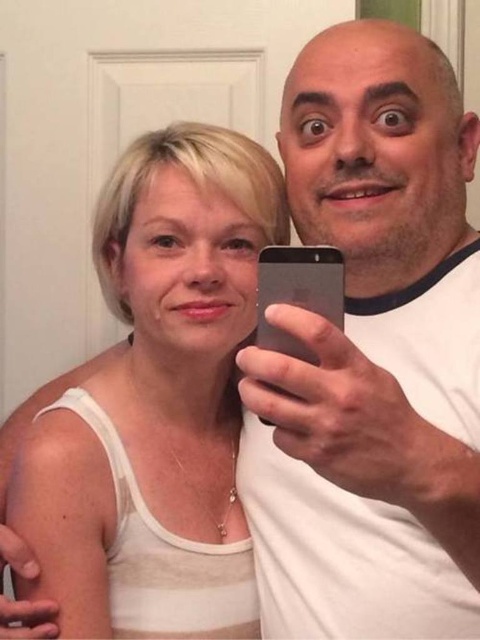
Can you confirm if white matte phone at center is bigger than white matte tank top at center?

Yes, white matte phone at center is bigger than white matte tank top at center.

Between white matte phone at center and white matte tank top at center, which one has more height?

white matte phone at center

Between point (453, 464) and point (168, 593), which one is positioned behind?

The point (168, 593) is more distant.

Locate an element on the screen. white matte phone at center is located at coordinates (372, 355).

Can you confirm if white matte tank top at center is positioned above black glass smartphone at center?

No, white matte tank top at center is not above black glass smartphone at center.

Locate an element on the screen. white matte tank top at center is located at coordinates (157, 403).

Does point (187, 451) come closer to viewer compared to point (325, 269)?

No, it is behind (325, 269).

What are the coordinates of `white matte tank top at center` in the screenshot? It's located at (157, 403).

Does white matte phone at center have a lesser width compared to black glass smartphone at center?

In fact, white matte phone at center might be wider than black glass smartphone at center.

Is white matte phone at center taller than black glass smartphone at center?

Indeed, white matte phone at center has a greater height compared to black glass smartphone at center.

Looking at this image, who is more distant from viewer, (300, 465) or (262, 420)?

Positioned behind is point (300, 465).

Locate an element on the screen. white matte phone at center is located at coordinates (372, 355).